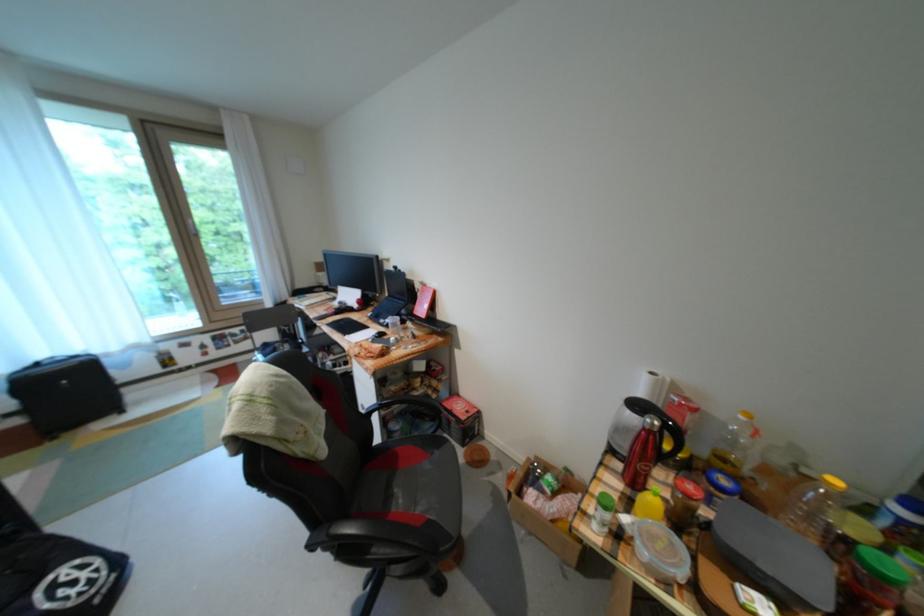
Locate an element on the screen. jar with blue lid is located at coordinates (719, 487).